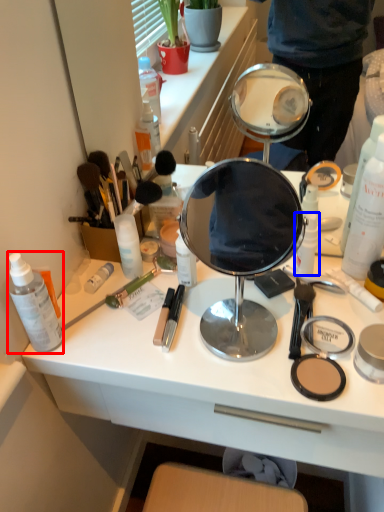
Question: Among these objects, which one is farthest to the camera, toiletry (highlighted by a red box) or toiletry (highlighted by a blue box)?

Choices:
 (A) toiletry
 (B) toiletry

Answer: (B)